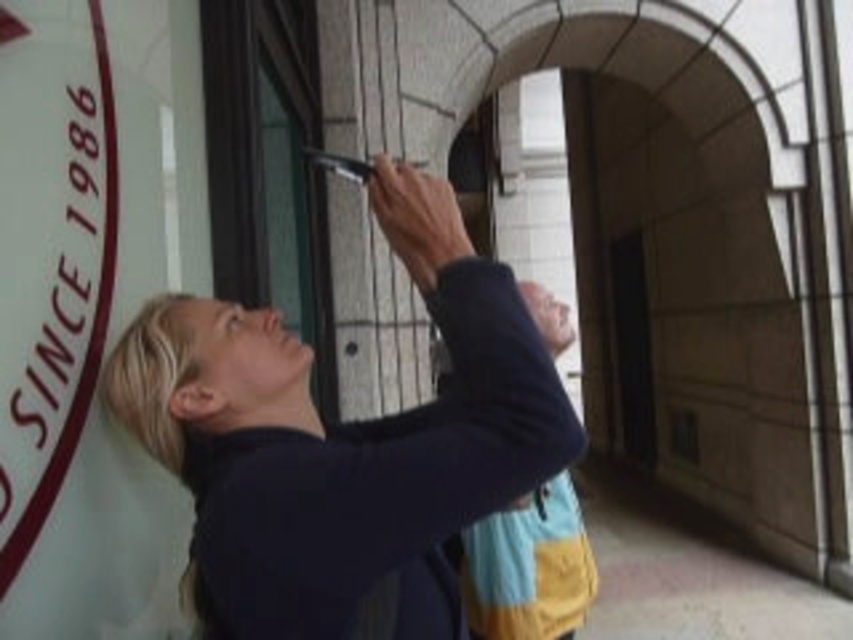
Question: Does matte black phone at upper center have a larger size compared to white matte sign at upper left?

Choices:
 (A) yes
 (B) no

Answer: (A)

Question: Is matte black phone at upper center to the right of white matte sign at upper left from the viewer's perspective?

Choices:
 (A) yes
 (B) no

Answer: (A)

Question: Does matte black phone at upper center appear on the right side of white matte sign at upper left?

Choices:
 (A) yes
 (B) no

Answer: (A)